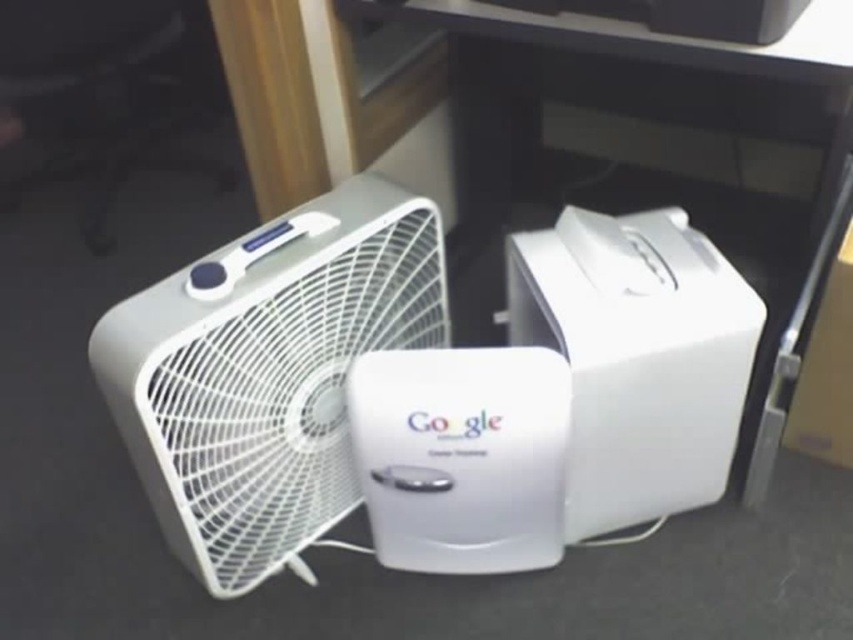
Question: Is white plastic computer desk at center behind white plastic fan at center?

Choices:
 (A) yes
 (B) no

Answer: (A)

Question: Which of the following is the closest to the observer?

Choices:
 (A) white plastic computer desk at center
 (B) white plastic fan at center

Answer: (B)

Question: Is white plastic computer desk at center wider than white plastic fan at center?

Choices:
 (A) no
 (B) yes

Answer: (B)

Question: Which point is farther to the camera?

Choices:
 (A) (616, 61)
 (B) (396, 248)

Answer: (A)

Question: Is white plastic computer desk at center to the right of white plastic fan at center from the viewer's perspective?

Choices:
 (A) yes
 (B) no

Answer: (A)